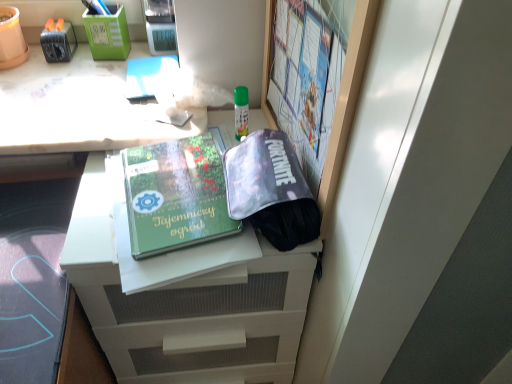
The height and width of the screenshot is (384, 512). Identify the location of vacant area on top of white glossy desk at upper left (from a real-world perspective). (103, 88).